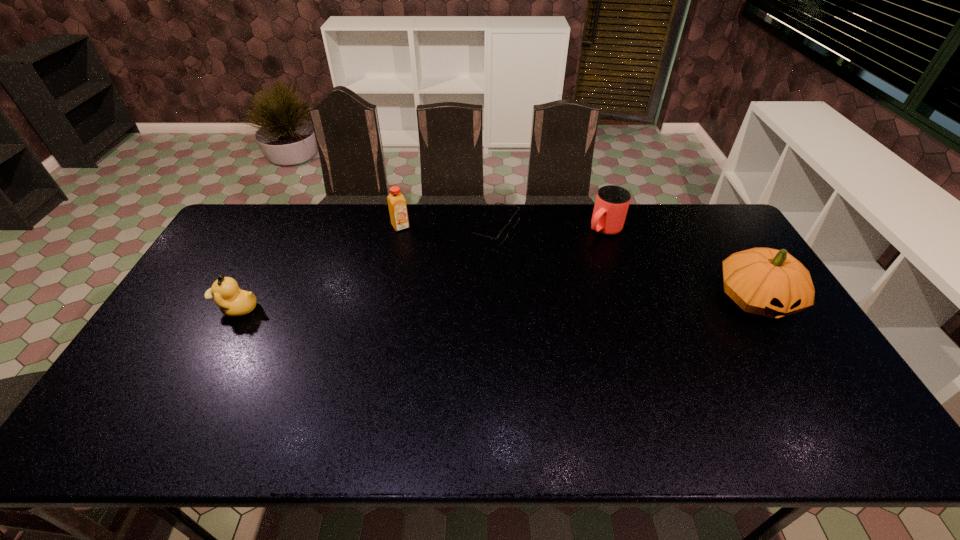
Where is `free location located with the lenses facing outward on the spectacles`? This screenshot has width=960, height=540. free location located with the lenses facing outward on the spectacles is located at coordinates (548, 280).

The image size is (960, 540). Find the location of `free space located with the lenses facing outward on the spectacles`. free space located with the lenses facing outward on the spectacles is located at coordinates (571, 302).

Locate an element on the screen. vacant space located 0.180m with the lenses facing outward on the spectacles is located at coordinates (543, 276).

What are the coordinates of `vacant region located 0.310m on the front and back of the orange juice` in the screenshot? It's located at (446, 285).

Where is `free space located 0.340m on the front and back of the orange juice`? This screenshot has width=960, height=540. free space located 0.340m on the front and back of the orange juice is located at coordinates (451, 291).

Where is `free point located 0.330m on the front and back of the orange juice`? free point located 0.330m on the front and back of the orange juice is located at coordinates (449, 289).

The image size is (960, 540). What are the coordinates of `blank space located on the handle side of the cup` in the screenshot? It's located at (537, 286).

Image resolution: width=960 pixels, height=540 pixels. In order to click on vacant space located on the handle side of the cup in this screenshot , I will do `click(524, 296)`.

The height and width of the screenshot is (540, 960). In order to click on free space located on the handle side of the cup in this screenshot , I will do `click(567, 261)`.

This screenshot has width=960, height=540. Find the location of `spectacles at the far edge`. spectacles at the far edge is located at coordinates (503, 234).